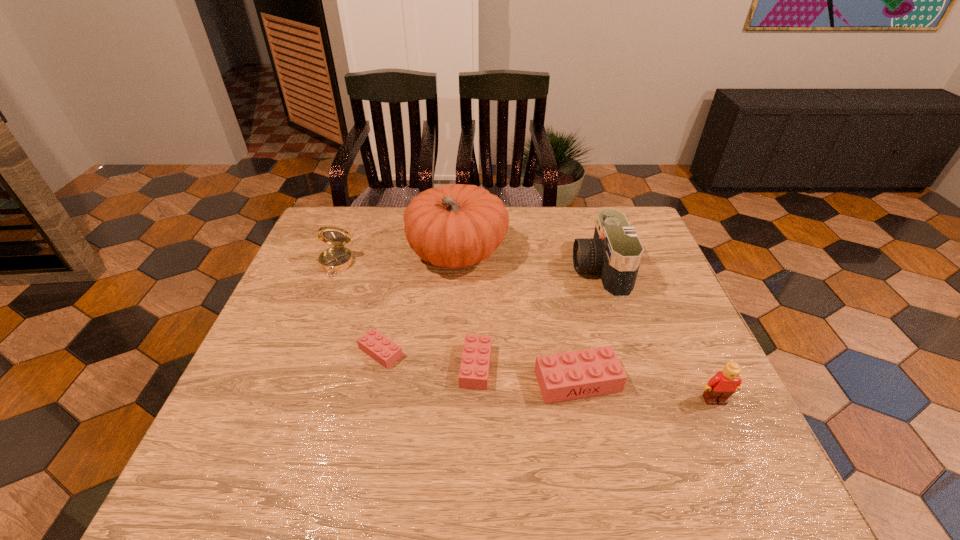
The width and height of the screenshot is (960, 540). What are the coordinates of `pumpkin present at the far edge` in the screenshot? It's located at (458, 225).

This screenshot has height=540, width=960. Identify the location of object that is positioned at the left edge. (338, 258).

Locate an element on the screen. The height and width of the screenshot is (540, 960). camera positioned at the right edge is located at coordinates (615, 252).

I want to click on Lego at the right edge, so click(719, 388).

Identify the location of object that is at the far right corner. The image size is (960, 540). (615, 252).

Identify the location of object that is at the near right corner. (719, 388).

The width and height of the screenshot is (960, 540). What are the coordinates of `free space at the far edge of the desktop` in the screenshot? It's located at (553, 245).

Where is `free space at the near edge of the desktop`? free space at the near edge of the desktop is located at coordinates (483, 430).

Locate an element on the screen. vacant region at the left edge is located at coordinates (302, 273).

The width and height of the screenshot is (960, 540). I want to click on vacant space at the right edge of the desktop, so click(x=656, y=255).